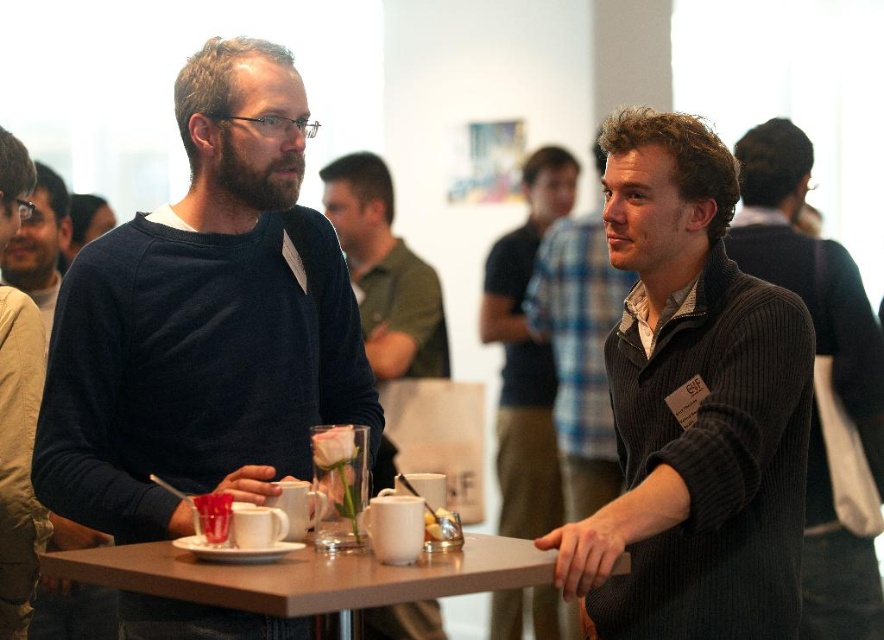
You are at a networking event and want to place a name tag on the ribbed sweater at center. The coordinate given is point (820, 380). Is this point a suitable location for placing the name tag?

Yes, the point (820, 380) is on the ribbed sweater at center, so it is a suitable location for placing the name tag.

What is located at the coordinate point (820, 380) in the image?

The ribbed sweater at center is located at point (820, 380).